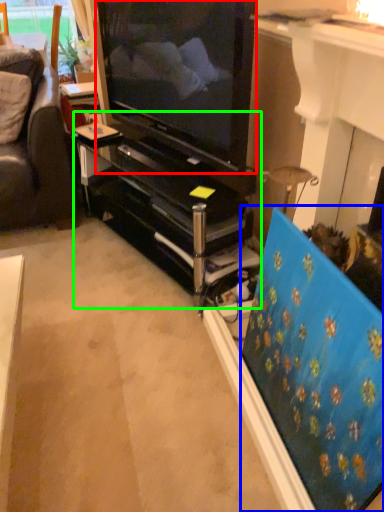
Question: Estimate the real-world distances between objects in this image. Which object is farther from television (highlighted by a red box), flat (highlighted by a blue box) or tv cabinet (highlighted by a green box)?

Choices:
 (A) flat
 (B) tv cabinet

Answer: (A)